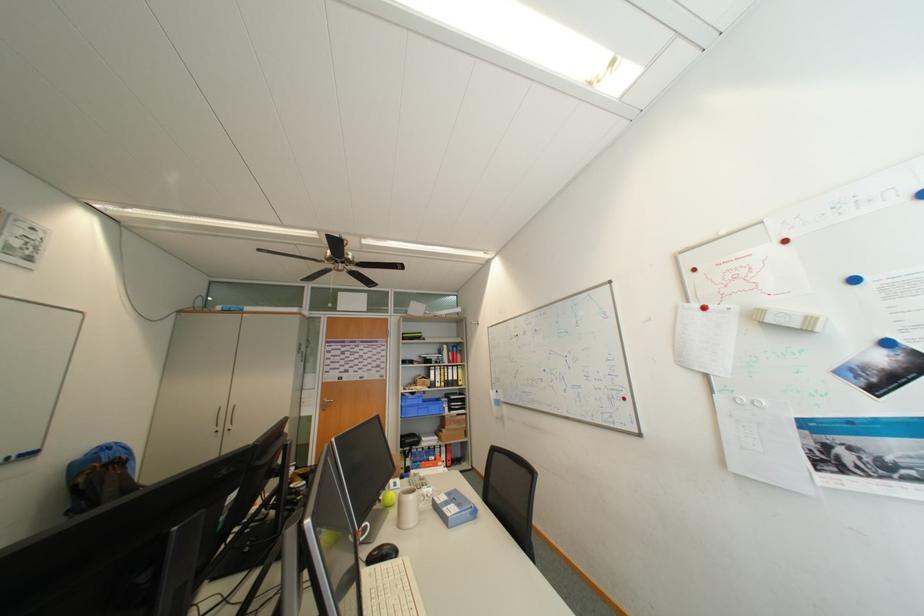
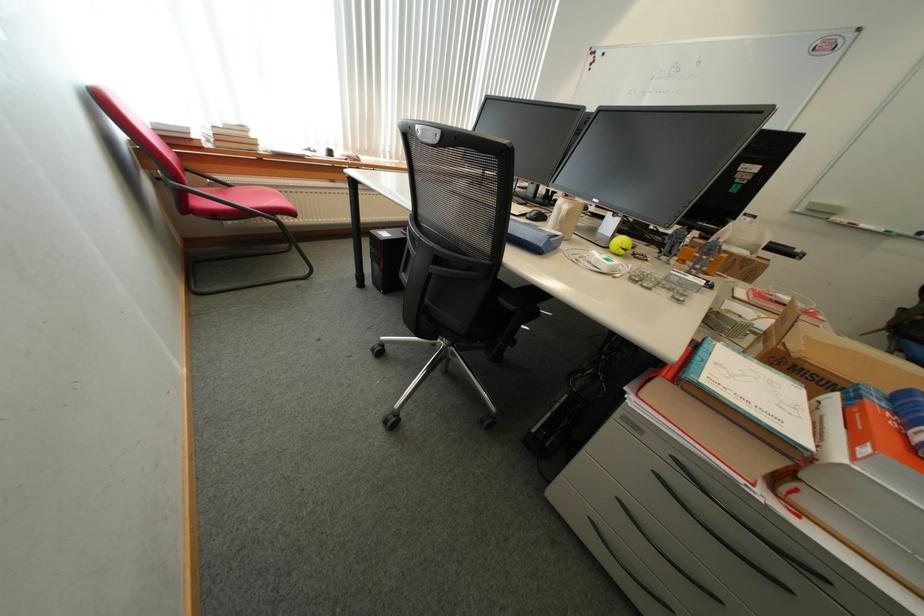
Find the pixel in the second image that matches (431,463) in the first image.

(906, 415)